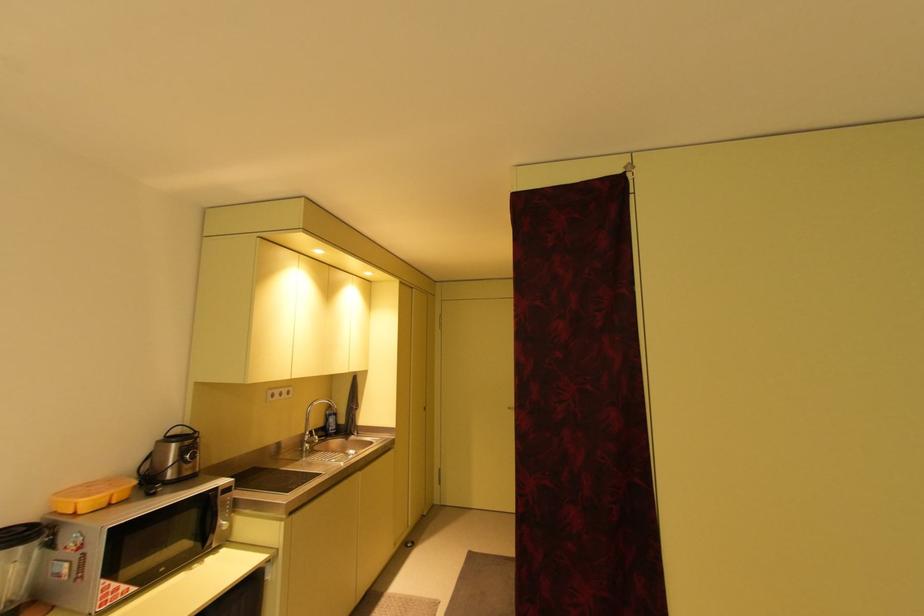
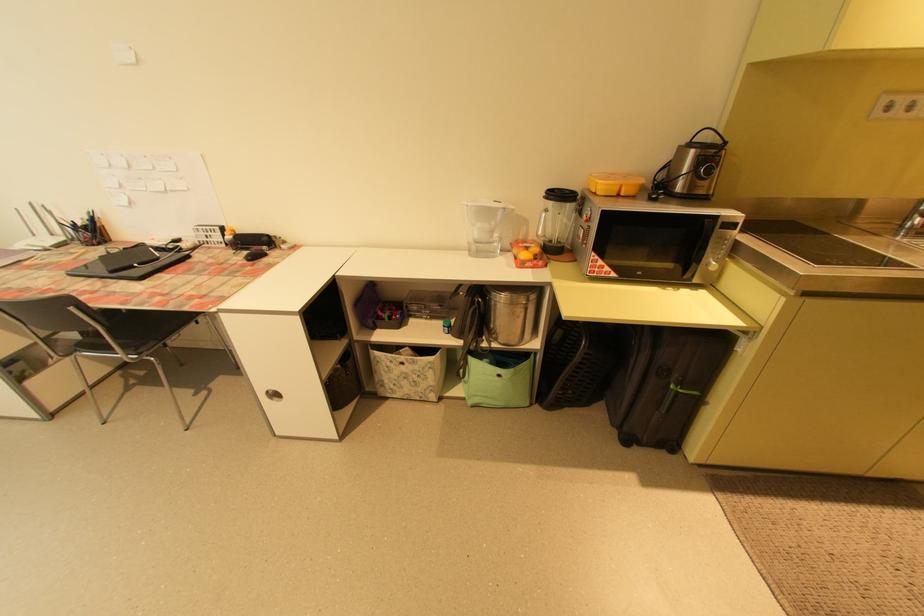
The point at (210, 548) is marked in the first image. Where is the corresponding point in the second image?

(688, 277)